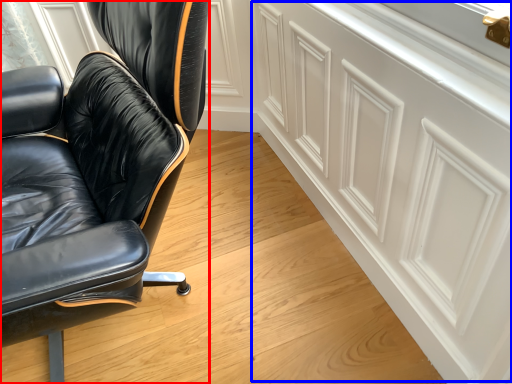
Question: Which object is further to the camera taking this photo, chair (highlighted by a red box) or cabinetry (highlighted by a blue box)?

Choices:
 (A) chair
 (B) cabinetry

Answer: (B)